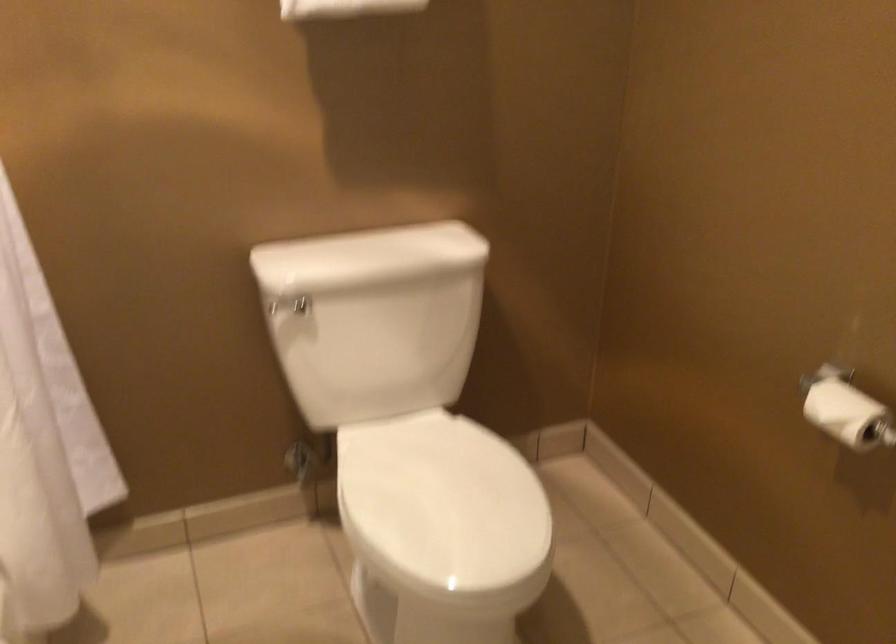
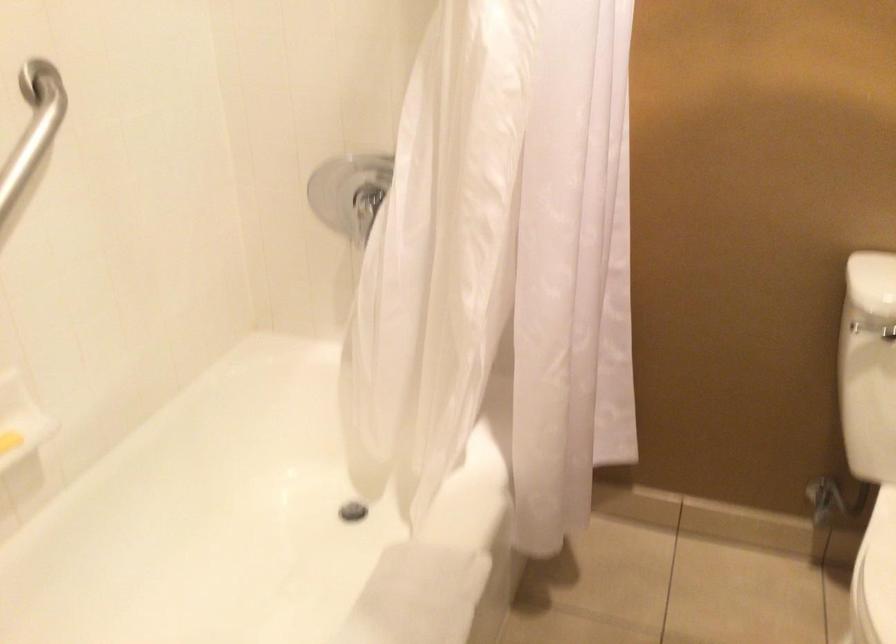
Question: The camera is either moving clockwise (left) or counter-clockwise (right) around the object. The first image is from the beginning of the video and the second image is from the end. Is the camera moving left or right when shooting the video?

Choices:
 (A) Left
 (B) Right

Answer: (B)